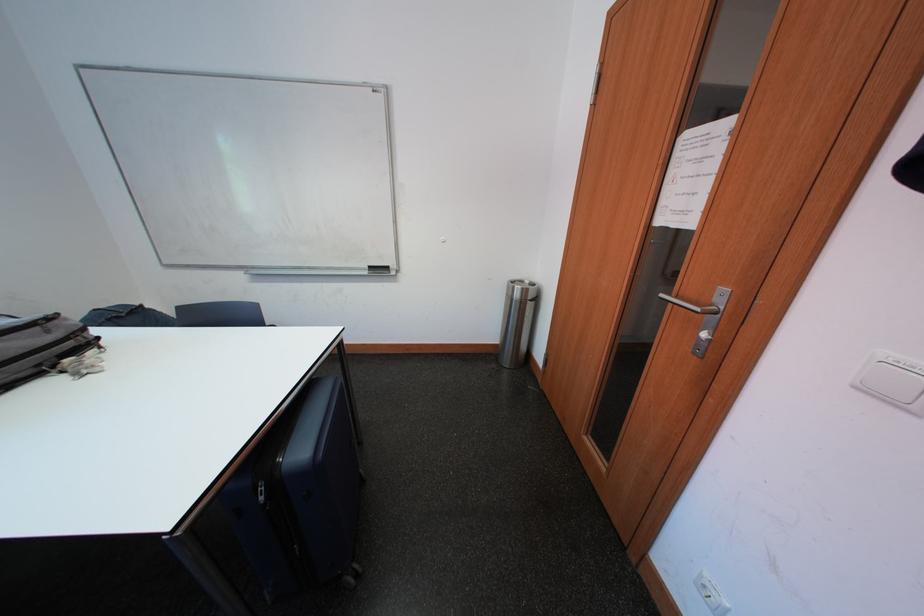
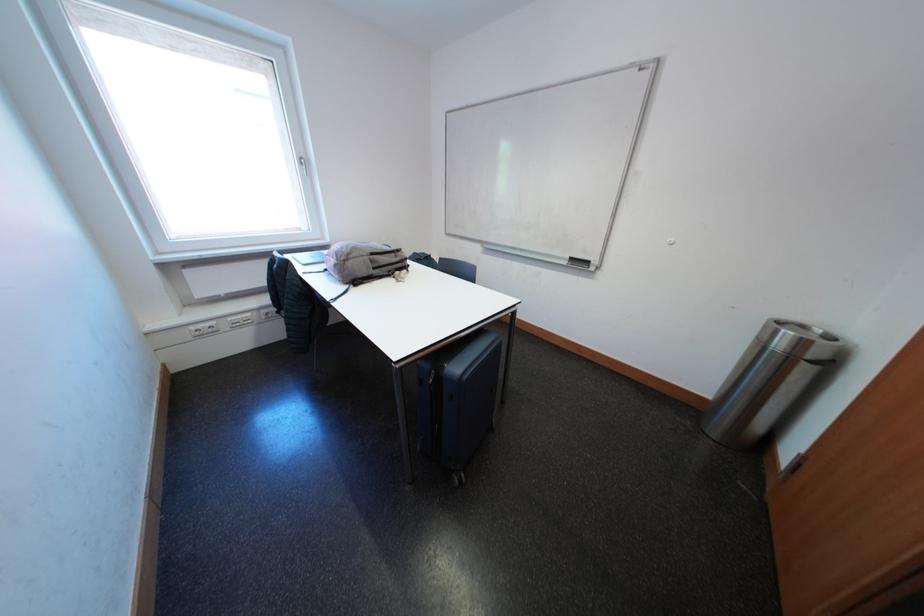
In the second image, find the point that corresponds to (58,334) in the first image.

(406, 261)